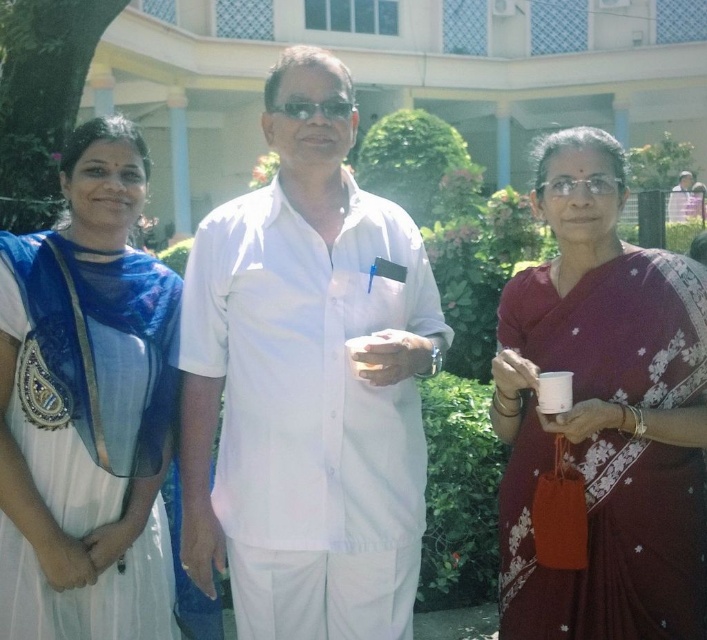
Question: Among these objects, which one is farthest from the camera?

Choices:
 (A) white matte shirt at center
 (B) maroon silk saree at right

Answer: (A)

Question: Can you confirm if white matte shirt at center is positioned to the left of maroon silk saree at right?

Choices:
 (A) yes
 (B) no

Answer: (A)

Question: Does white matte shirt at center have a larger size compared to white silk saree at left?

Choices:
 (A) yes
 (B) no

Answer: (A)

Question: Which point appears closest to the camera in this image?

Choices:
 (A) (18, 490)
 (B) (572, 579)
 (C) (310, 168)

Answer: (A)

Question: Which object is the closest to the white matte shirt at center?

Choices:
 (A) white silk saree at left
 (B) maroon silk saree at right

Answer: (A)

Question: Does white matte shirt at center appear on the right side of maroon silk saree at right?

Choices:
 (A) no
 (B) yes

Answer: (A)